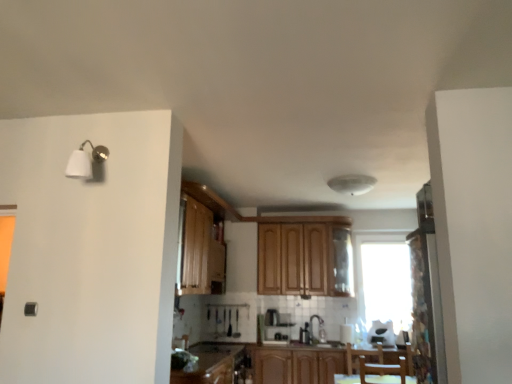
Question: Which direction should I rotate to look at wooden cabinets at center, which is the first cabinetry from bottom to top?

Choices:
 (A) right
 (B) left

Answer: (A)

Question: Is wooden cabinet at center, which appears as the 1th cabinetry when viewed from the top, positioned with its back to white glossy sink at center?

Choices:
 (A) no
 (B) yes

Answer: (A)

Question: Can you confirm if wooden cabinet at center, the 3th cabinetry from the bottom, is taller than white glossy sink at center?

Choices:
 (A) yes
 (B) no

Answer: (A)

Question: Does wooden cabinet at center, which appears as the 1th cabinetry when viewed from the top, come in front of white glossy sink at center?

Choices:
 (A) no
 (B) yes

Answer: (A)

Question: Can you confirm if wooden cabinet at center, the 3th cabinetry from the bottom, is bigger than white glossy sink at center?

Choices:
 (A) no
 (B) yes

Answer: (B)

Question: Is wooden cabinet at center, which appears as the 1th cabinetry when viewed from the top, positioned behind white glossy sink at center?

Choices:
 (A) no
 (B) yes

Answer: (B)

Question: Can you confirm if wooden cabinet at center, the 3th cabinetry from the bottom, is thinner than white glossy sink at center?

Choices:
 (A) no
 (B) yes

Answer: (A)

Question: Is wooden cabinet at lower center, arranged as the second cabinetry when ordered from the bottom, far from white glossy sink at center?

Choices:
 (A) no
 (B) yes

Answer: (B)

Question: From the image's perspective, is wooden cabinet at lower center, which is the second cabinetry from top to bottom, located above white glossy sink at center?

Choices:
 (A) yes
 (B) no

Answer: (B)

Question: Is wooden cabinet at lower center, which is the second cabinetry from top to bottom, to the right of white glossy sink at center from the viewer's perspective?

Choices:
 (A) yes
 (B) no

Answer: (B)

Question: Is wooden cabinet at lower center, which is the second cabinetry from top to bottom, wider than white glossy sink at center?

Choices:
 (A) yes
 (B) no

Answer: (A)

Question: Is wooden cabinet at lower center, which is the second cabinetry from top to bottom, surrounding white glossy sink at center?

Choices:
 (A) no
 (B) yes

Answer: (A)

Question: Does wooden cabinet at lower center, arranged as the second cabinetry when ordered from the bottom, have a greater height compared to white glossy sink at center?

Choices:
 (A) yes
 (B) no

Answer: (B)

Question: Is brown wooden chair at lower center taller than patterned fabric screen door at right?

Choices:
 (A) yes
 (B) no

Answer: (B)